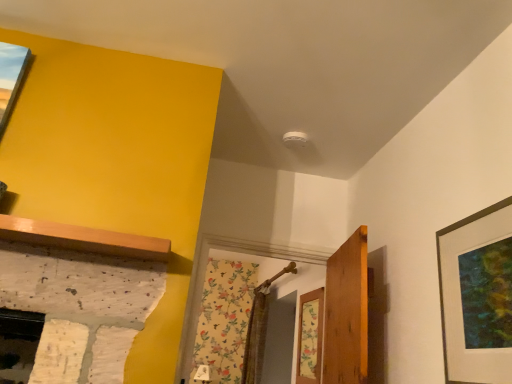
Question: Based on their sizes in the image, would you say matte black picture frame at right is bigger or smaller than wooden door at center?

Choices:
 (A) big
 (B) small

Answer: (B)

Question: Is matte black picture frame at right in front of or behind wooden door at center in the image?

Choices:
 (A) behind
 (B) front

Answer: (B)

Question: Which object is positioned closest to the wooden door at center?

Choices:
 (A) matte black picture frame at right
 (B) floral wallpaper at center

Answer: (B)

Question: Which of these objects is positioned closest to the wooden door at center?

Choices:
 (A) matte black picture frame at right
 (B) floral wallpaper at center

Answer: (B)